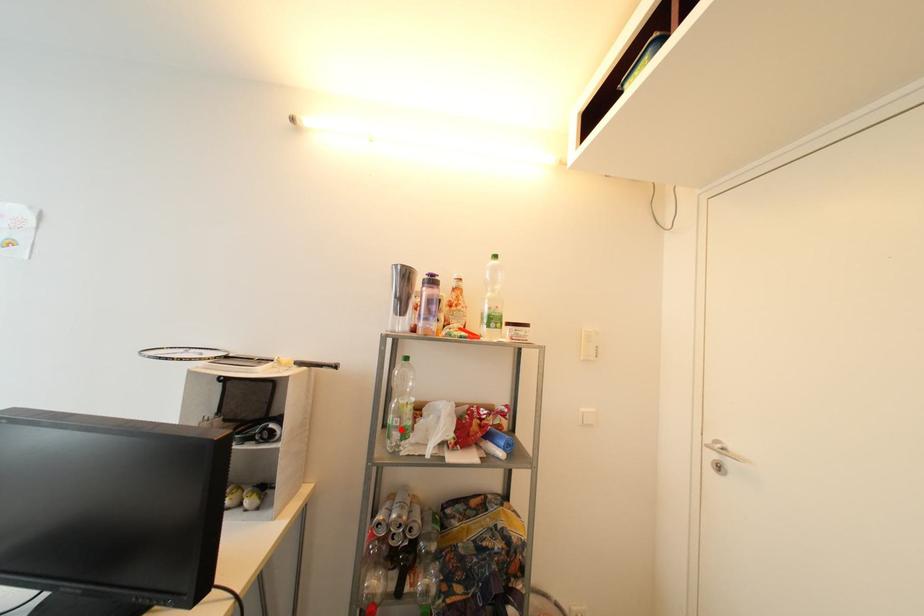
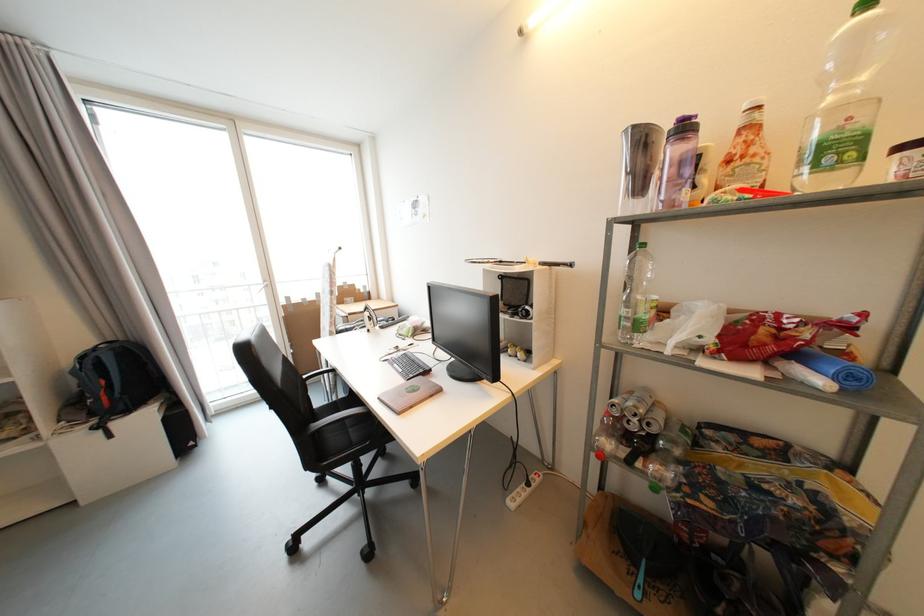
Locate, in the second image, the point that corresponds to the highlighted location in the first image.

(631, 320)